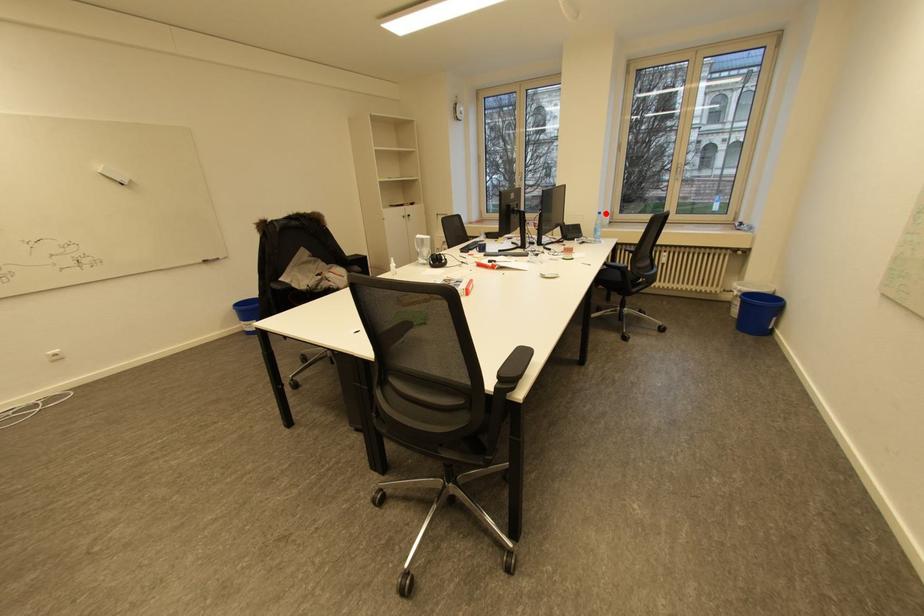
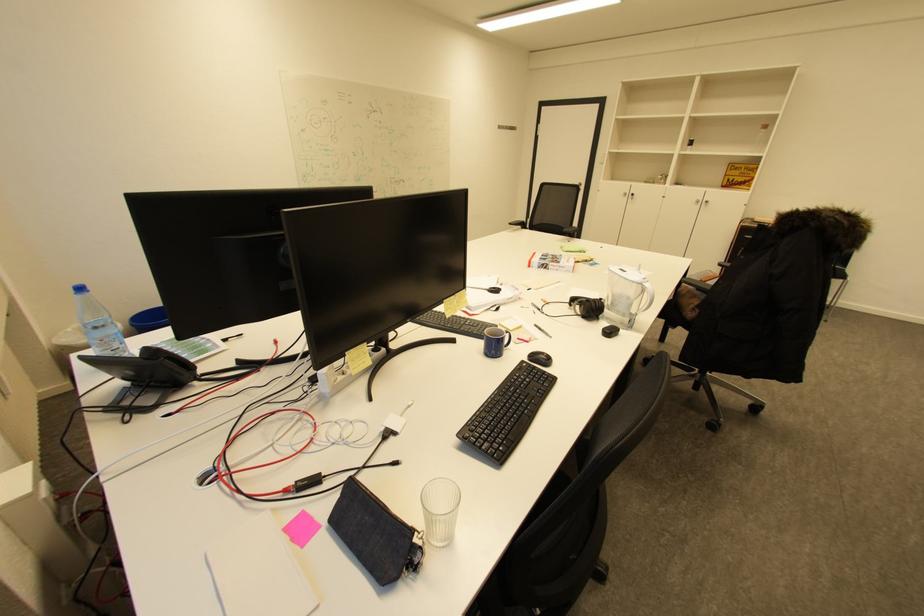
Find the pixel in the second image that matches the highlighted location in the first image.

(88, 290)